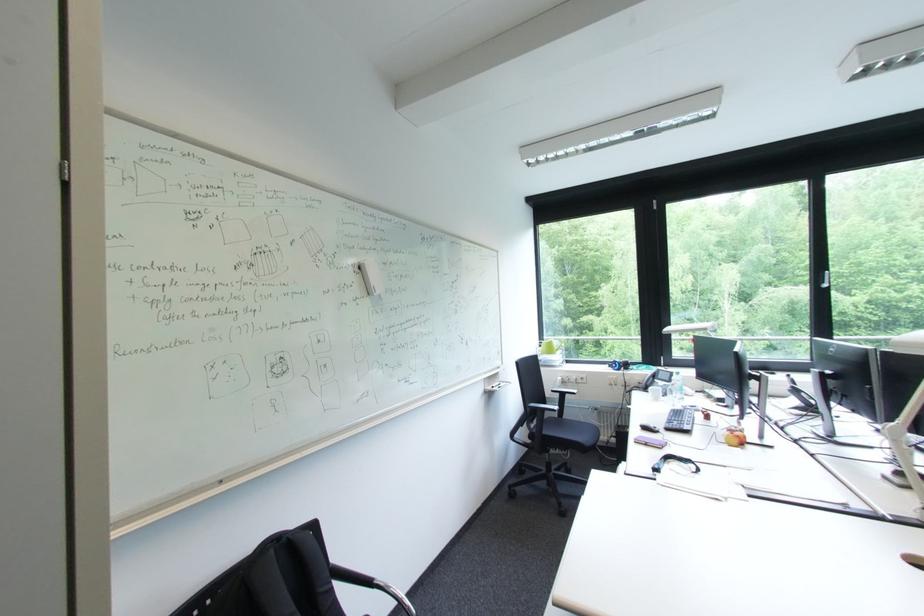
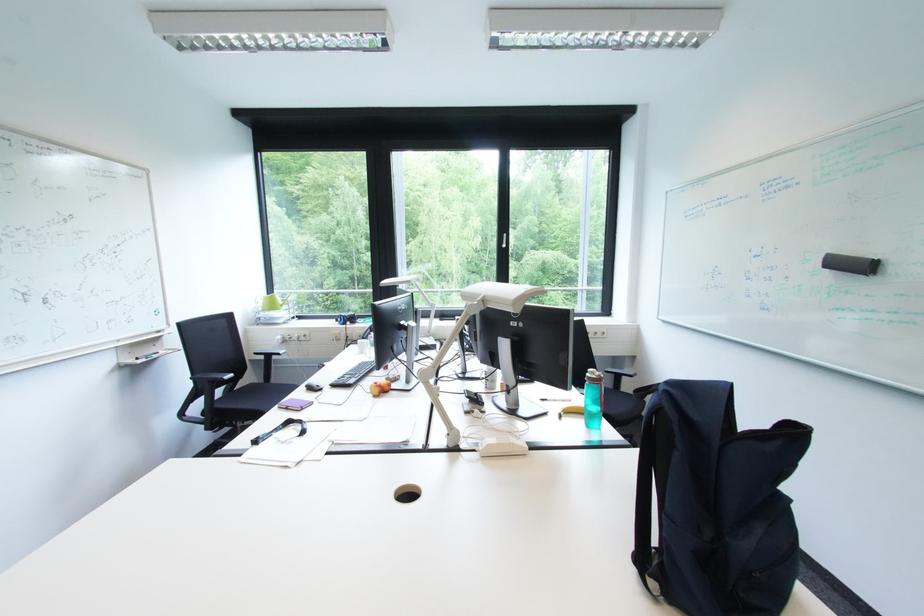
Find the pixel in the second image that matches (x=550, y=355) in the first image.

(270, 310)